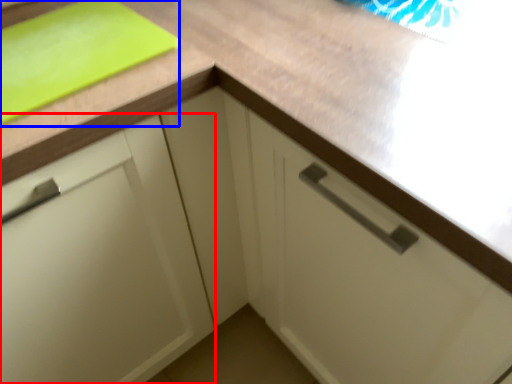
Question: Which object is closer to the camera taking this photo, cabinetry (highlighted by a red box) or cutting board (highlighted by a blue box)?

Choices:
 (A) cabinetry
 (B) cutting board

Answer: (A)